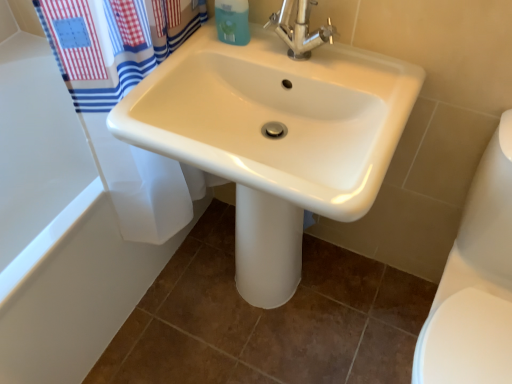
Question: Considering their positions, is blue matte soap dispenser at upper center located in front of or behind white glossy bathtub at upper left?

Choices:
 (A) front
 (B) behind

Answer: (B)

Question: Is blue matte soap dispenser at upper center inside or outside of white glossy bathtub at upper left?

Choices:
 (A) inside
 (B) outside

Answer: (B)

Question: Estimate the real-world distances between objects in this image. Which object is farther from the blue matte soap dispenser at upper center?

Choices:
 (A) chrome metallic faucet at upper center
 (B) white glossy bathtub at upper left
 (C) white glossy sink at center
 (D) white glossy toilet bowl at lower right

Answer: (D)

Question: Which of these objects is positioned closest to the white glossy toilet bowl at lower right?

Choices:
 (A) white glossy bathtub at upper left
 (B) white glossy sink at center
 (C) blue matte soap dispenser at upper center
 (D) chrome metallic faucet at upper center

Answer: (B)